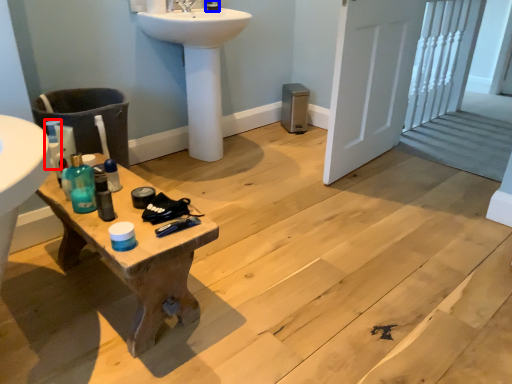
Question: Which of the following is the closest to the observer, bottle (highlighted by a red box) or toiletry (highlighted by a blue box)?

Choices:
 (A) bottle
 (B) toiletry

Answer: (A)